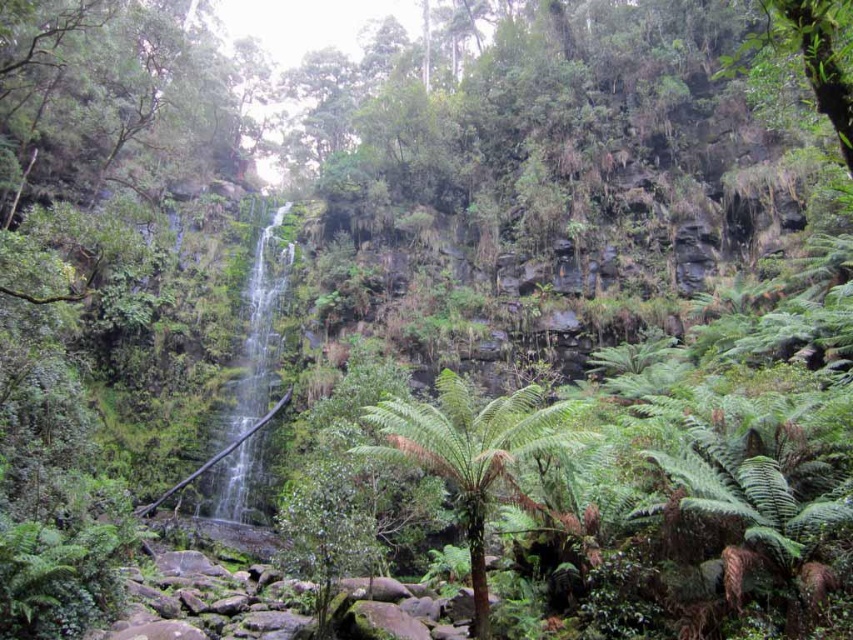
Question: From the image, what is the correct spatial relationship of green leafy fern at center in relation to green mossy waterfall at center?

Choices:
 (A) below
 (B) above

Answer: (A)

Question: Is green leafy fern at center positioned behind green mossy waterfall at center?

Choices:
 (A) no
 (B) yes

Answer: (A)

Question: Is green leafy fern at center thinner than green mossy waterfall at center?

Choices:
 (A) no
 (B) yes

Answer: (B)